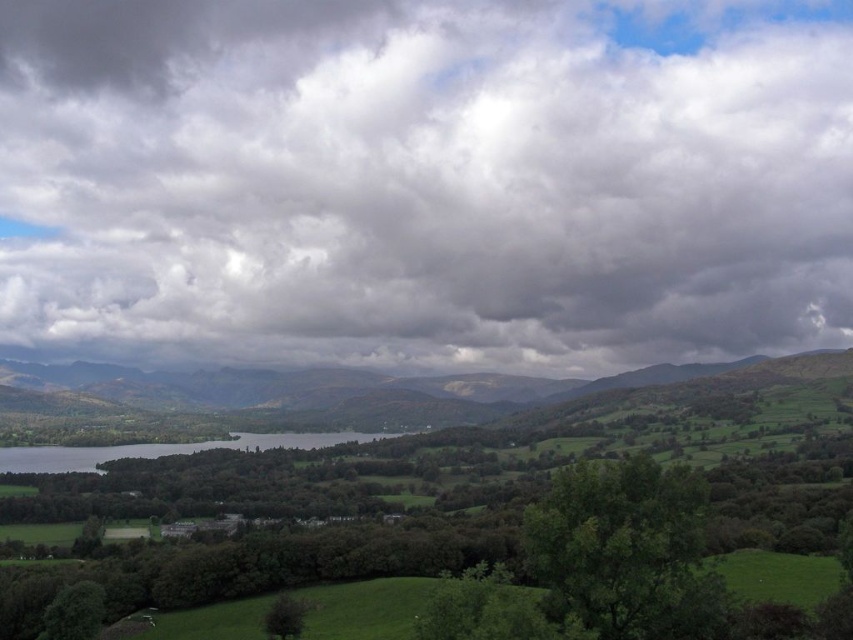
Does point (318, 33) lie in front of point (73, 449)?

That is False.

Can you confirm if cloudy sky at upper center is bigger than green grassy water at lower left?

Indeed, cloudy sky at upper center has a larger size compared to green grassy water at lower left.

This screenshot has width=853, height=640. Find the location of `cloudy sky at upper center`. cloudy sky at upper center is located at coordinates (424, 182).